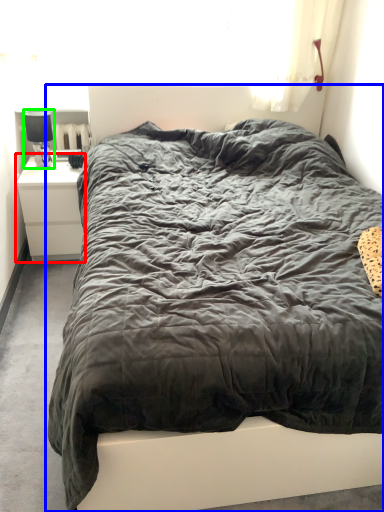
Question: Estimate the real-world distances between objects in this image. Which object is closer to nightstand (highlighted by a red box), bed (highlighted by a blue box) or lamp (highlighted by a green box)?

Choices:
 (A) bed
 (B) lamp

Answer: (B)